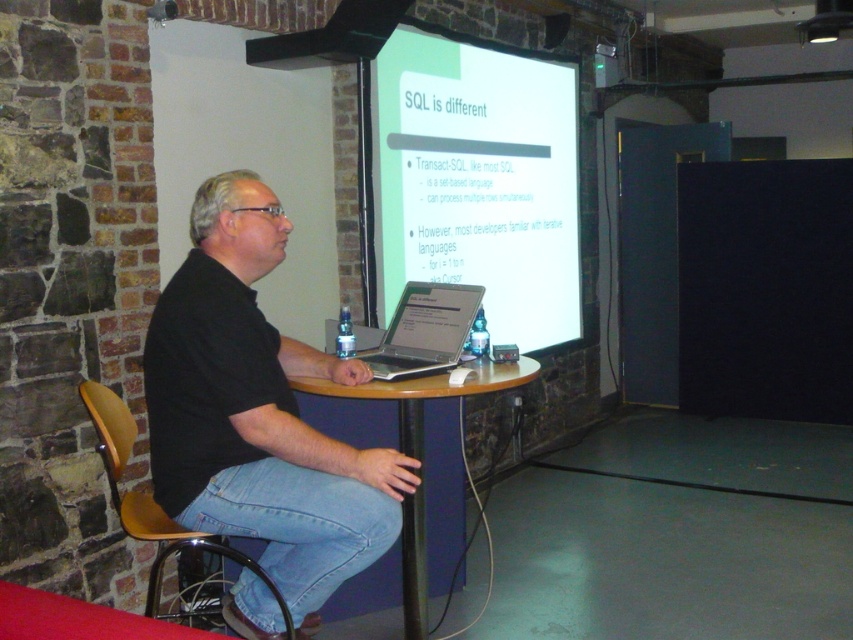
Question: Which is farther from the silver metallic laptop at center?

Choices:
 (A) black matte shirt at center
 (B) white glossy projector screen at upper center
 (C) black glass table at center
 (D) brown wood chair at left

Answer: (B)

Question: Does white glossy projector screen at upper center have a lesser width compared to brown wood chair at left?

Choices:
 (A) no
 (B) yes

Answer: (A)

Question: Is black matte shirt at center smaller than silver metallic laptop at center?

Choices:
 (A) no
 (B) yes

Answer: (A)

Question: Which object is the farthest from the black glass table at center?

Choices:
 (A) brown wood chair at left
 (B) black matte shirt at center
 (C) silver metallic laptop at center

Answer: (A)

Question: Which point is closer to the camera taking this photo?

Choices:
 (A) (x=392, y=100)
 (B) (x=189, y=356)
 (C) (x=465, y=284)
 (D) (x=296, y=378)

Answer: (B)

Question: Does black matte shirt at center come in front of silver metallic laptop at center?

Choices:
 (A) no
 (B) yes

Answer: (B)